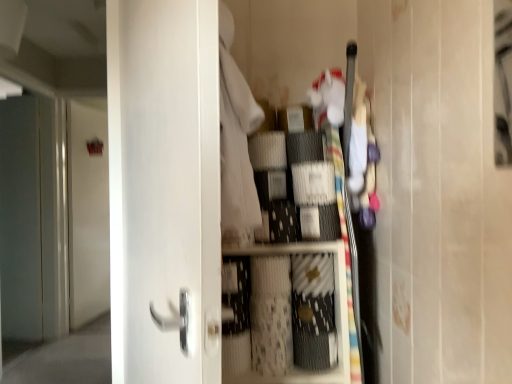
Question: Is white matte door at upper left, which is the 1th door in back-to-front order, bigger than white glossy door at center, which is counted as the first door, starting from the front?

Choices:
 (A) no
 (B) yes

Answer: (A)

Question: Can you confirm if white matte door at upper left, the 2th door from the right, is positioned to the right of white glossy door at center, which appears as the first door when viewed from the right?

Choices:
 (A) yes
 (B) no

Answer: (B)

Question: From a real-world perspective, is white matte door at upper left, the second door from the front, physically below white glossy door at center, which is counted as the 2th door, starting from the left?

Choices:
 (A) yes
 (B) no

Answer: (A)

Question: From the image's perspective, is white matte door at upper left, placed as the first door when sorted from left to right, over white glossy door at center, which is counted as the 2th door, starting from the left?

Choices:
 (A) yes
 (B) no

Answer: (B)

Question: Is white matte door at upper left, the 2th door from the right, to the left of white glossy door at center, which is counted as the 2th door, starting from the left, from the viewer's perspective?

Choices:
 (A) no
 (B) yes

Answer: (B)

Question: In the image, is white glossy door at center, which is counted as the first door, starting from the front, positioned in front of or behind matte gray screen door at left?

Choices:
 (A) behind
 (B) front

Answer: (B)

Question: In terms of height, does white glossy door at center, which is counted as the second door, starting from the back, look taller or shorter compared to matte gray screen door at left?

Choices:
 (A) short
 (B) tall

Answer: (A)

Question: In terms of size, does white glossy door at center, which appears as the first door when viewed from the right, appear bigger or smaller than matte gray screen door at left?

Choices:
 (A) big
 (B) small

Answer: (B)

Question: From a real-world perspective, is white glossy door at center, which is counted as the 2th door, starting from the left, physically located above or below matte gray screen door at left?

Choices:
 (A) above
 (B) below

Answer: (A)

Question: Is matte gray screen door at left wider or thinner than white glossy door at center, which is counted as the first door, starting from the front?

Choices:
 (A) thin
 (B) wide

Answer: (A)

Question: From the image's perspective, is matte gray screen door at left positioned above or below white glossy door at center, which is counted as the first door, starting from the front?

Choices:
 (A) below
 (B) above

Answer: (A)

Question: Which is correct: matte gray screen door at left is inside white glossy door at center, which is counted as the 2th door, starting from the left, or outside of it?

Choices:
 (A) inside
 (B) outside

Answer: (B)

Question: Considering the relative positions of matte gray screen door at left and white glossy door at center, which is counted as the first door, starting from the front, in the image provided, is matte gray screen door at left to the left or to the right of white glossy door at center, which is counted as the first door, starting from the front,?

Choices:
 (A) right
 (B) left

Answer: (B)

Question: From the image's perspective, relative to white matte drawer at center, is white matte door at upper left, the second door from the front, above or below?

Choices:
 (A) above
 (B) below

Answer: (A)

Question: From a real-world perspective, is white matte door at upper left, placed as the first door when sorted from left to right, physically located above or below white matte drawer at center?

Choices:
 (A) below
 (B) above

Answer: (B)